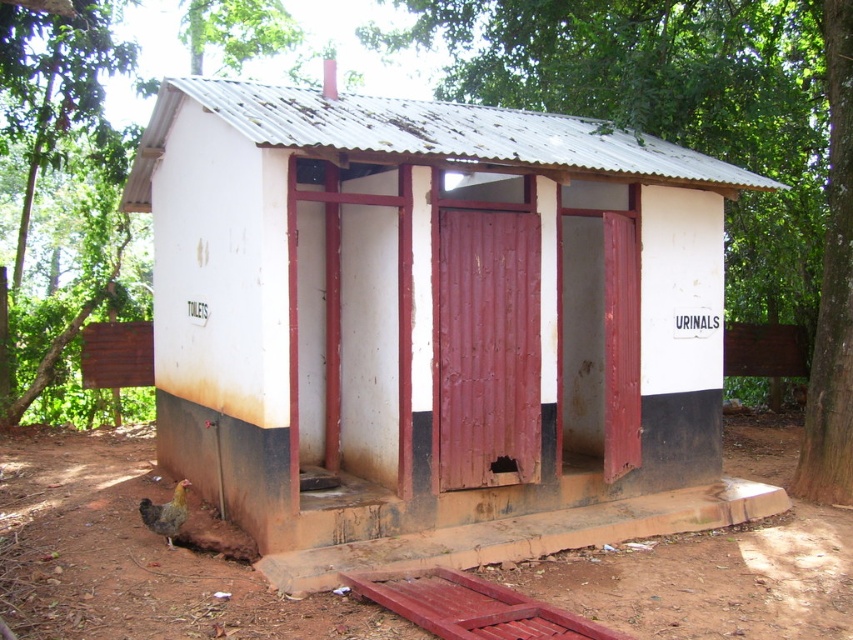
Question: Is white matte toilet at center thinner than green leafy tree at center?

Choices:
 (A) yes
 (B) no

Answer: (A)

Question: Which point is closer to the camera?

Choices:
 (A) (682, 68)
 (B) (155, 522)
 (C) (705, 198)

Answer: (B)

Question: Is green leafy tree at center to the right of brown feathered chicken at lower left from the viewer's perspective?

Choices:
 (A) no
 (B) yes

Answer: (B)

Question: Does white matte toilet at center have a greater width compared to green leafy tree at center?

Choices:
 (A) no
 (B) yes

Answer: (A)

Question: Which of the following is the closest to the observer?

Choices:
 (A) brown feathered chicken at lower left
 (B) green leafy tree at center

Answer: (A)

Question: Which point is closer to the camera?

Choices:
 (A) (671, 52)
 (B) (300, 529)
 (C) (155, 509)

Answer: (B)